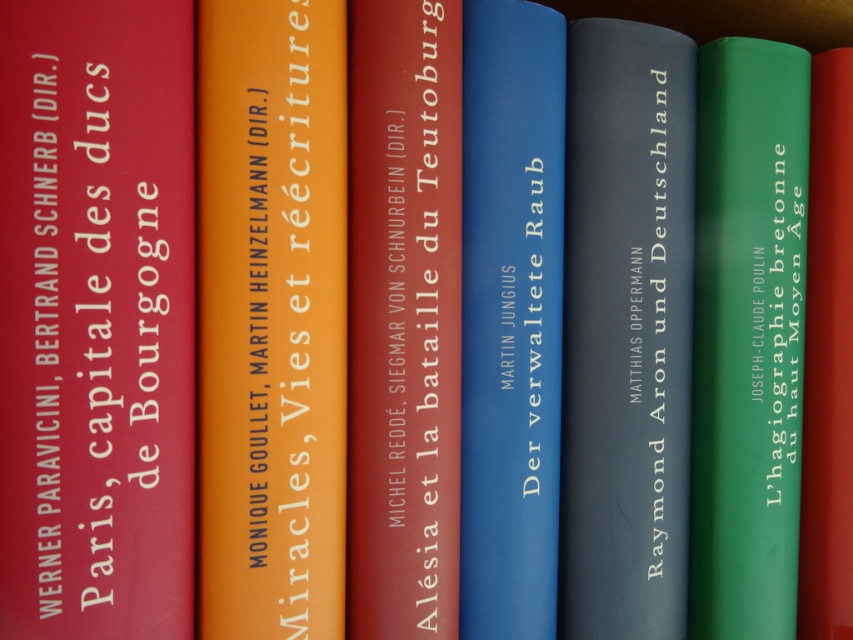
Question: Does matte red book at left come behind matte red book at center?

Choices:
 (A) yes
 (B) no

Answer: (B)

Question: Based on their relative distances, which object is farther from the green matte book at center?

Choices:
 (A) orange matte book at center
 (B) matte blue book at center
 (C) matte red book at left

Answer: (C)

Question: Is orange matte book at center above green matte book at right?

Choices:
 (A) no
 (B) yes

Answer: (B)

Question: Observing the image, what is the correct spatial positioning of orange matte book at center in reference to green matte book at center?

Choices:
 (A) right
 (B) left

Answer: (B)

Question: Which point is farther to the camera?

Choices:
 (A) (258, 520)
 (B) (51, 563)
 (C) (596, 499)

Answer: (C)

Question: Which point appears farthest from the camera in this image?

Choices:
 (A) (532, 148)
 (B) (630, 390)

Answer: (B)